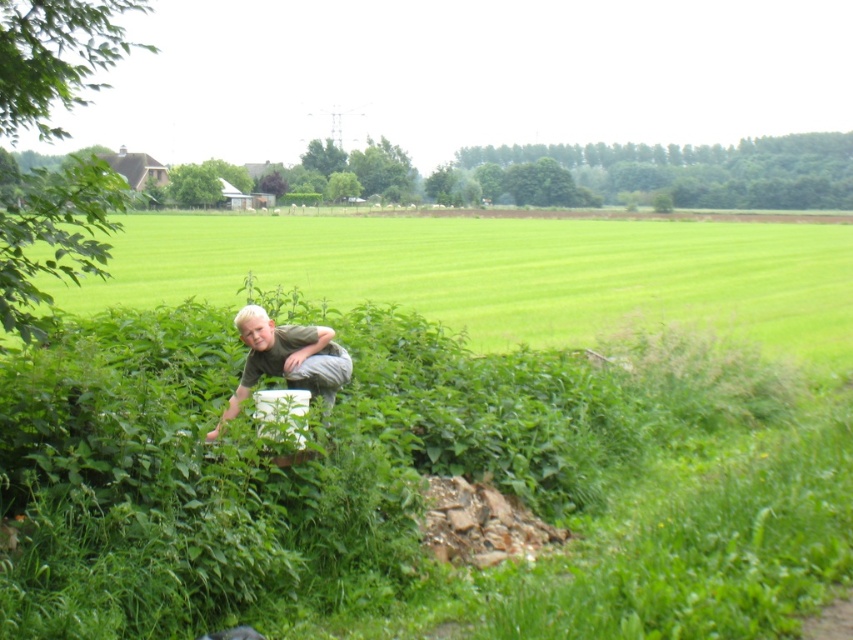
You are a photographer trying to capture a clear shot of the light brown fabric shirt at center. However, the green leafy grass at center is blocking your view. Can you determine if the grass is tall enough to obscure the shirt from your camera angle?

The green leafy grass at center is much taller as light brown fabric shirt at center, so yes, the grass is tall enough to block the view of the light brown fabric shirt at center.

You are a person who is 5 feet tall. You want to see over the green leafy grass at center to look at the distant buildings. Can you see over the grass?

The green leafy grass at center and viewer are 14.00 feet apart from each other. Since the grass is at center and the viewer is 14 feet away, the height of the grass is not provided, so it is impossible to determine if a 5 feet tall person can see over it.

From the picture: You are a photographer trying to capture the green leafy grass at center and the green grass at lower center in a single frame. Based on their positions, which one will appear larger in the photo?

The green leafy grass at center will appear larger in the photo because it is closer to the viewer than the green grass at lower center.